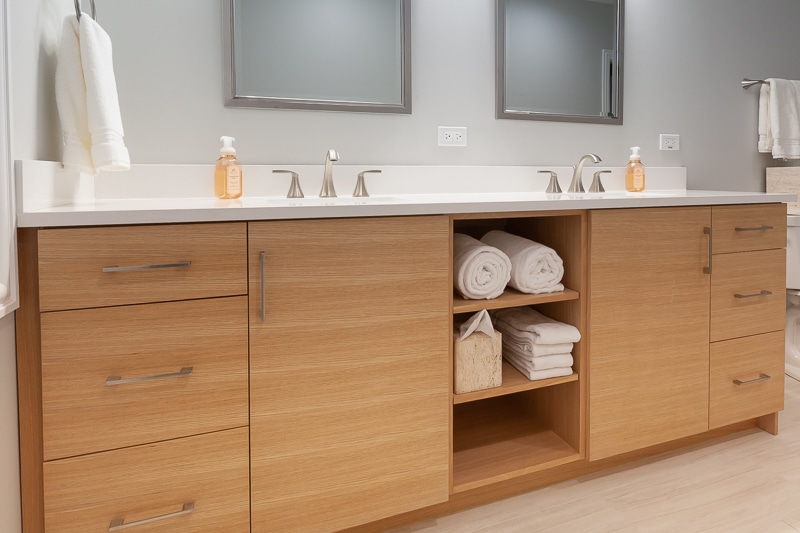
This screenshot has width=800, height=533. What are the coordinates of `right cabinet` in the screenshot? It's located at (620, 274).